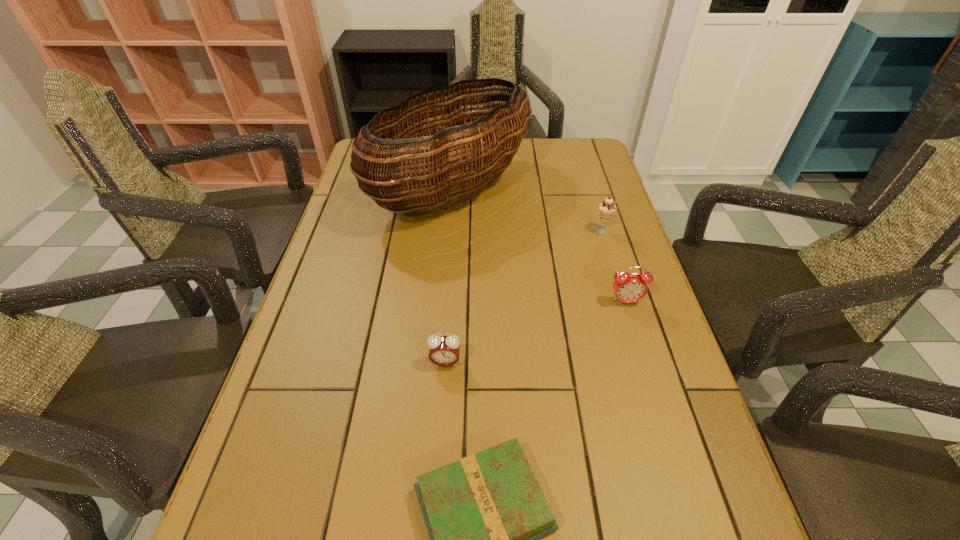
Identify the location of free space that is in between the basket and the third nearest object. (539, 247).

The image size is (960, 540). In order to click on vacant space in between the second nearest object and the tallest object in this screenshot , I will do `click(448, 278)`.

You are a GUI agent. You are given a task and a screenshot of the screen. Output one action in this format:
    pyautogui.click(x=<x>, y=<y>)
    Task: Click on the free space that is in between the taller alarm clock and the tallest object
    The width and height of the screenshot is (960, 540).
    Given the screenshot: What is the action you would take?
    pyautogui.click(x=539, y=247)

Select which object is the second closest to the farther alarm clock. Please provide its 2D coordinates. Your answer should be formatted as a tuple, i.e. [(x, y)], where the tuple contains the x and y coordinates of a point satisfying the conditions above.

[(469, 149)]

What are the coordinates of `object that is the closest to the nearest object` in the screenshot? It's located at (443, 350).

Identify which alarm clock is the second nearest to the icecream. Please provide its 2D coordinates. Your answer should be formatted as a tuple, i.e. [(x, y)], where the tuple contains the x and y coordinates of a point satisfying the conditions above.

[(443, 350)]